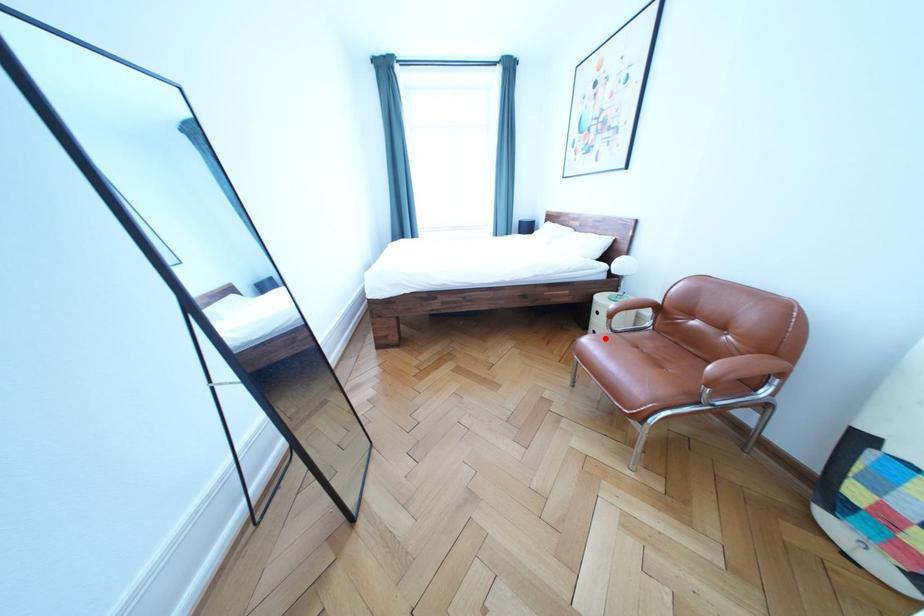
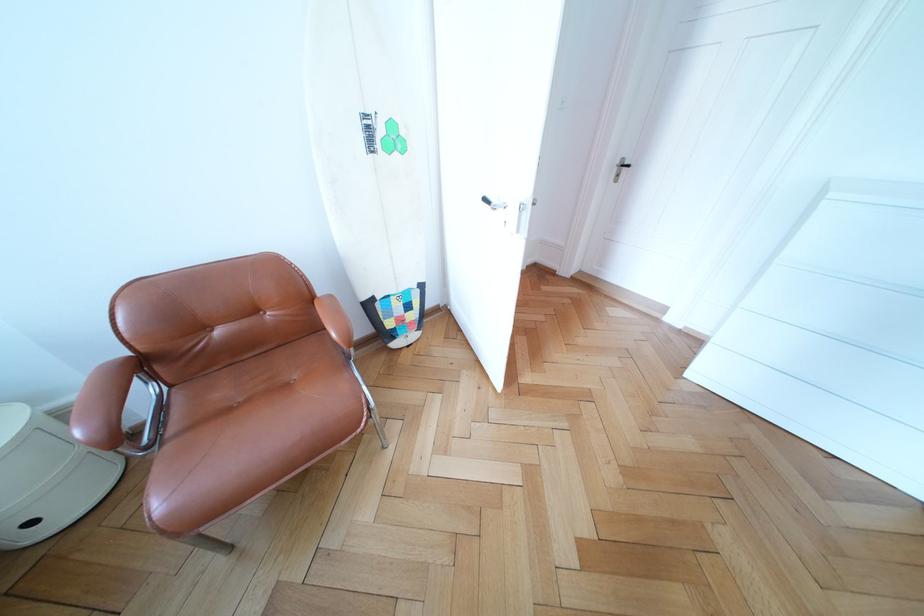
In the second image, find the point that corresponds to the highlighted location in the first image.

(43, 529)